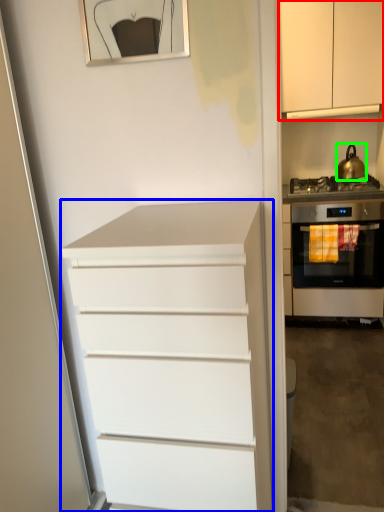
Question: Estimate the real-world distances between objects in this image. Which object is farther from cabinetry (highlighted by a red box), chest of drawers (highlighted by a blue box) or kitchen appliance (highlighted by a green box)?

Choices:
 (A) chest of drawers
 (B) kitchen appliance

Answer: (A)